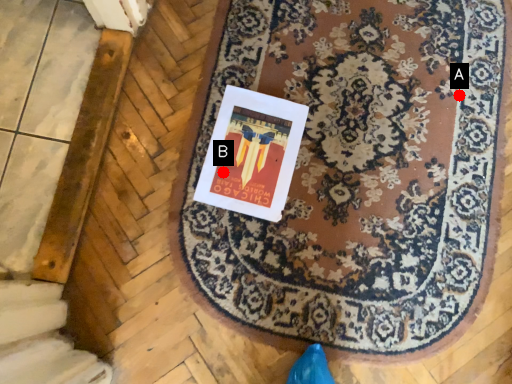
Question: Two points are circled on the image, labeled by A and B beside each circle. Which of the following is the closest to the observer?

Choices:
 (A) A is closer
 (B) B is closer

Answer: (B)